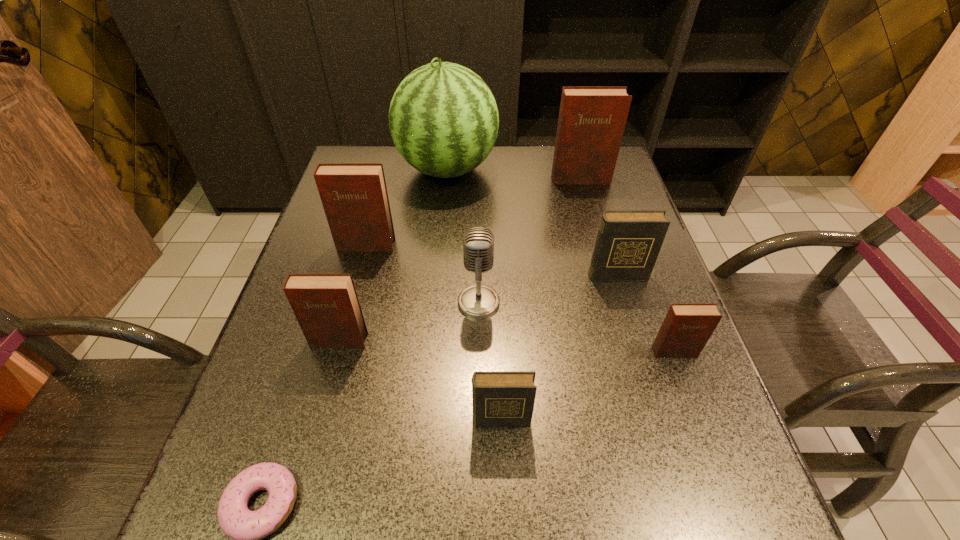
At what (x,y) coordinates should I click in order to perform the action: click on free space between the second smallest reddish-brown diary and the tallest diary. Please return your answer as a coordinate pair (x, y). Image resolution: width=960 pixels, height=540 pixels. Looking at the image, I should click on (460, 260).

The width and height of the screenshot is (960, 540). Find the location of `vacant point located between the fifth nearest diary and the microphone`. vacant point located between the fifth nearest diary and the microphone is located at coordinates (422, 274).

Find the location of `vacant area between the second smallest reddish-brown diary and the biggest reddish-brown diary`. vacant area between the second smallest reddish-brown diary and the biggest reddish-brown diary is located at coordinates (460, 260).

The image size is (960, 540). Identify the location of vacant space in between the microphone and the green watermelon. (463, 236).

I want to click on empty space that is in between the farthest reddish-brown diary and the green watermelon, so click(x=514, y=174).

Find the location of a particular element. This screenshot has height=540, width=960. free space between the biggest reddish-brown diary and the green watermelon is located at coordinates (514, 174).

The image size is (960, 540). Identify the location of object that can be found as the seventh closest to the second farthest diary. (246, 528).

At what (x,y) coordinates should I click in order to perform the action: click on object that is the closest to the third diary from left to right. Please return your answer as a coordinate pair (x, y). The width and height of the screenshot is (960, 540). Looking at the image, I should click on (478, 301).

Identify which diary is located as the fourth nearest to the farthest reddish-brown diary. Please provide its 2D coordinates. Your answer should be formatted as a tuple, i.e. [(x, y)], where the tuple contains the x and y coordinates of a point satisfying the conditions above.

[(326, 306)]

Identify which diary is the fourth closest to the right dark diary. Please provide its 2D coordinates. Your answer should be formatted as a tuple, i.e. [(x, y)], where the tuple contains the x and y coordinates of a point satisfying the conditions above.

[(354, 196)]